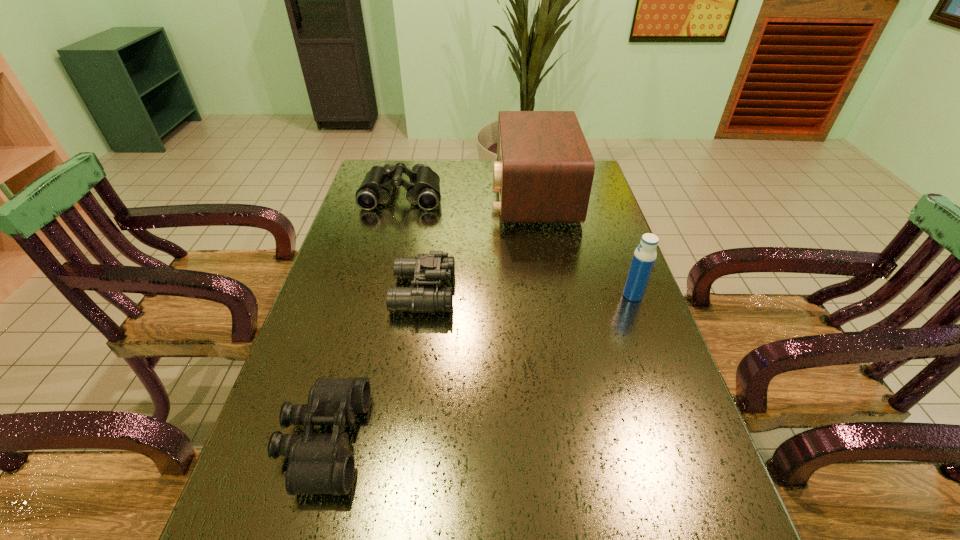
Locate an element on the screen. The height and width of the screenshot is (540, 960). free space located 0.190m on the front panel of the tallest object is located at coordinates (438, 194).

The height and width of the screenshot is (540, 960). What are the coordinates of `vacant area situated 0.100m on the back of the fourth shortest object` in the screenshot? It's located at (621, 265).

Where is `vacant space located 0.310m through the lenses of the second nearest binoculars`? The width and height of the screenshot is (960, 540). vacant space located 0.310m through the lenses of the second nearest binoculars is located at coordinates (569, 293).

Identify the location of vacant area located on the front-facing side of the farthest binoculars. Image resolution: width=960 pixels, height=540 pixels. (396, 222).

Where is `vacant point located at the eyepieces of the nearest object`? This screenshot has width=960, height=540. vacant point located at the eyepieces of the nearest object is located at coordinates (478, 441).

Locate an element on the screen. This screenshot has height=540, width=960. radio receiver at the far edge is located at coordinates (544, 169).

Identify the location of binoculars located in the far edge section of the desktop. The height and width of the screenshot is (540, 960). (423, 189).

The height and width of the screenshot is (540, 960). Find the location of `radio receiver positioned at the right edge`. radio receiver positioned at the right edge is located at coordinates tap(544, 169).

Where is `water bottle that is at the right edge`? This screenshot has height=540, width=960. water bottle that is at the right edge is located at coordinates (645, 255).

This screenshot has width=960, height=540. What are the coordinates of `object present at the far left corner` in the screenshot? It's located at (423, 189).